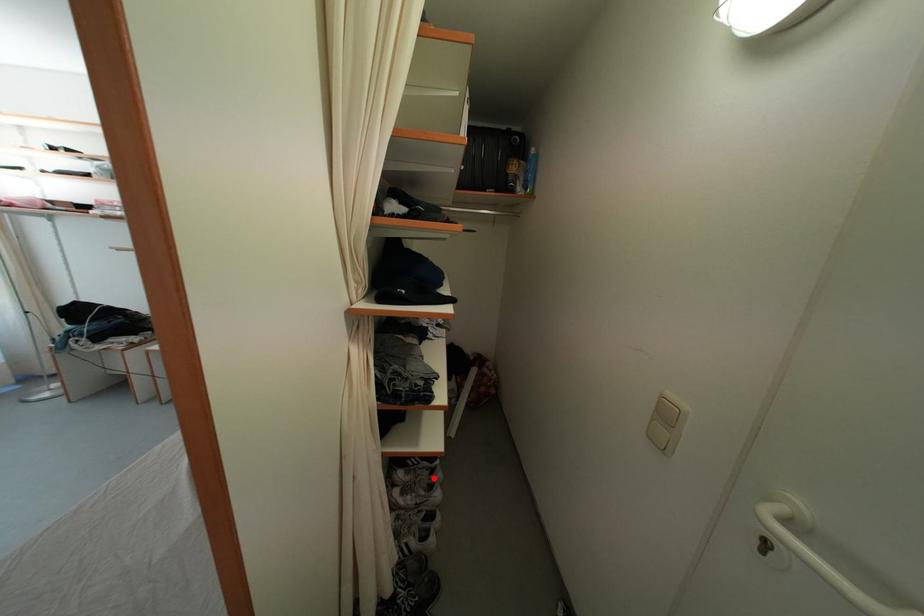
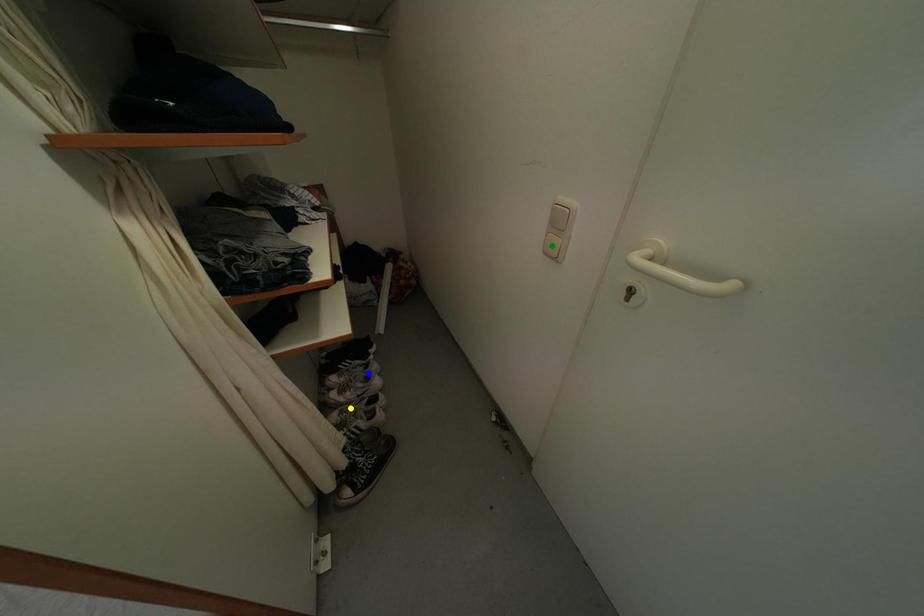
Question: I am providing you with two images of the same scene from different viewpoints. A red point is marked on the first image. You are given multiple points on the second image. Which point in image 2 is actually the same real-world point as the red point in image 1?

Choices:
 (A) green point
 (B) blue point
 (C) yellow point

Answer: (B)